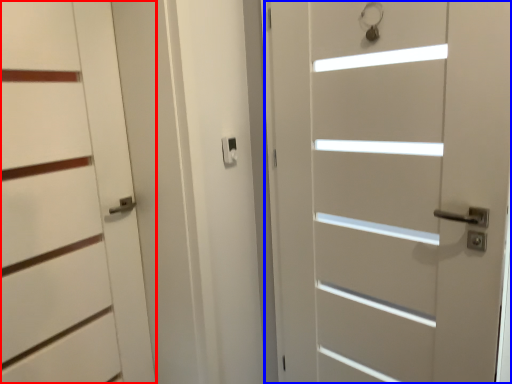
Question: Which object appears farthest to the camera in this image, door (highlighted by a red box) or door (highlighted by a blue box)?

Choices:
 (A) door
 (B) door

Answer: (A)